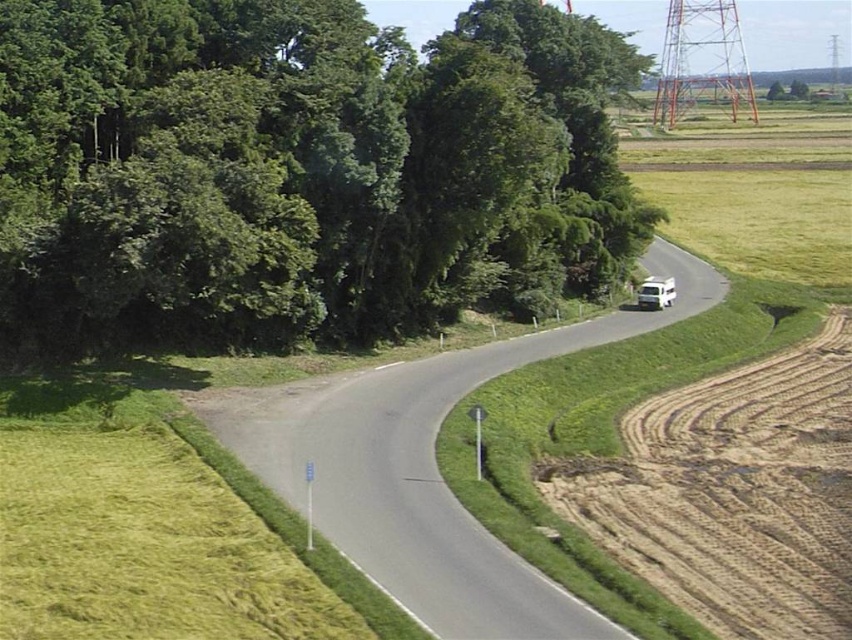
Question: From the image, what is the correct spatial relationship of green leafy trees at upper left in relation to brown textured dirt track at right?

Choices:
 (A) left
 (B) right

Answer: (A)

Question: Which object is closer to the camera taking this photo?

Choices:
 (A) brown textured dirt track at right
 (B) green leafy trees at upper left

Answer: (A)

Question: Is green leafy trees at upper left wider than brown textured dirt track at right?

Choices:
 (A) no
 (B) yes

Answer: (B)

Question: Does green leafy trees at upper left lie behind brown textured dirt track at right?

Choices:
 (A) yes
 (B) no

Answer: (A)

Question: Which object is farther from the camera taking this photo?

Choices:
 (A) brown textured dirt track at right
 (B) green leafy trees at upper left

Answer: (B)